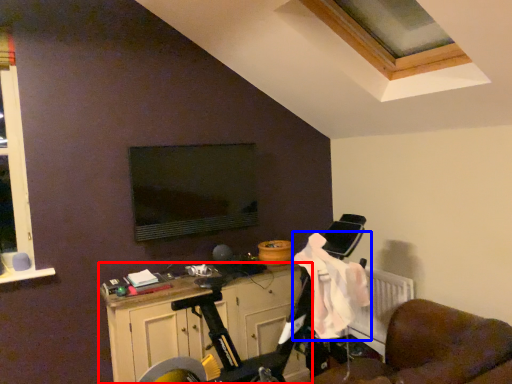
Question: Which point is further to the camera, cabinetry (highlighted by a red box) or laundry (highlighted by a blue box)?

Choices:
 (A) cabinetry
 (B) laundry

Answer: (A)